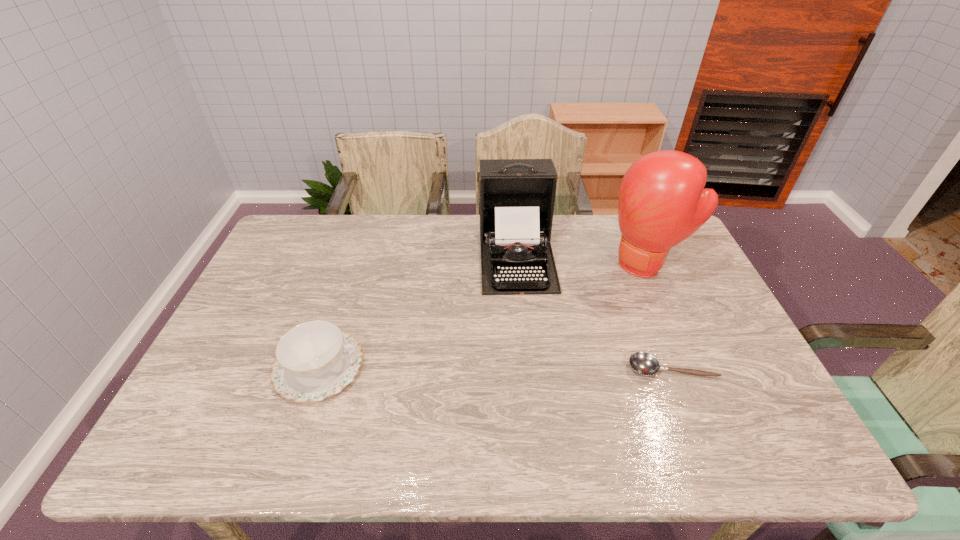
Locate an element on the screen. This screenshot has height=540, width=960. vacant space that's between the third shortest object and the second shortest object is located at coordinates (418, 310).

Where is `vacant area between the tallest object and the leftmost object`? This screenshot has width=960, height=540. vacant area between the tallest object and the leftmost object is located at coordinates (483, 316).

Locate an element on the screen. The image size is (960, 540). free area in between the second tallest object and the ladle is located at coordinates (594, 311).

You are a GUI agent. You are given a task and a screenshot of the screen. Output one action in this format:
    pyautogui.click(x=<x>, y=<y>)
    Task: Click on the free point between the second shortest object and the ladle
    The image size is (960, 540).
    Given the screenshot: What is the action you would take?
    pyautogui.click(x=495, y=368)

The image size is (960, 540). I want to click on vacant space in between the shortest object and the chinaware, so [x=495, y=368].

Locate which object is the closest to the second object from left to right. Please provide its 2D coordinates. Your answer should be formatted as a tuple, i.e. [(x, y)], where the tuple contains the x and y coordinates of a point satisfying the conditions above.

[(662, 201)]

Find the location of a particular element. The width and height of the screenshot is (960, 540). object that stands as the third closest to the ladle is located at coordinates (314, 360).